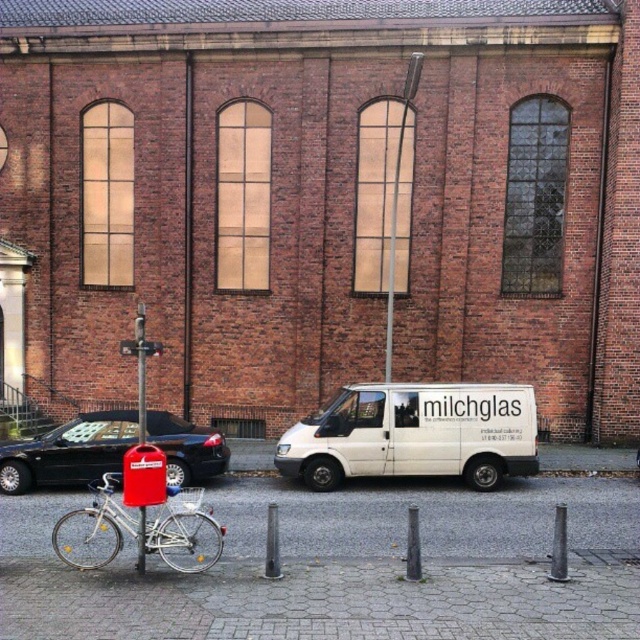
Question: Does white matte van at center lie behind silver metallic bicycle at lower left?

Choices:
 (A) no
 (B) yes

Answer: (B)

Question: Which object is farther from the camera taking this photo?

Choices:
 (A) white matte van at center
 (B) silver metallic bicycle at lower left

Answer: (A)

Question: Is the position of shiny black car at lower left more distant than that of silver metallic bicycle at lower left?

Choices:
 (A) no
 (B) yes

Answer: (B)

Question: Considering the real-world distances, which object is closest to the white matte van at center?

Choices:
 (A) silver metallic bicycle at lower left
 (B) shiny black car at lower left

Answer: (B)

Question: In this image, where is white matte van at center located relative to shiny black car at lower left?

Choices:
 (A) above
 (B) below

Answer: (A)

Question: Which point is farther to the camera?

Choices:
 (A) (188, 476)
 (B) (291, 477)
 (C) (72, 544)

Answer: (B)